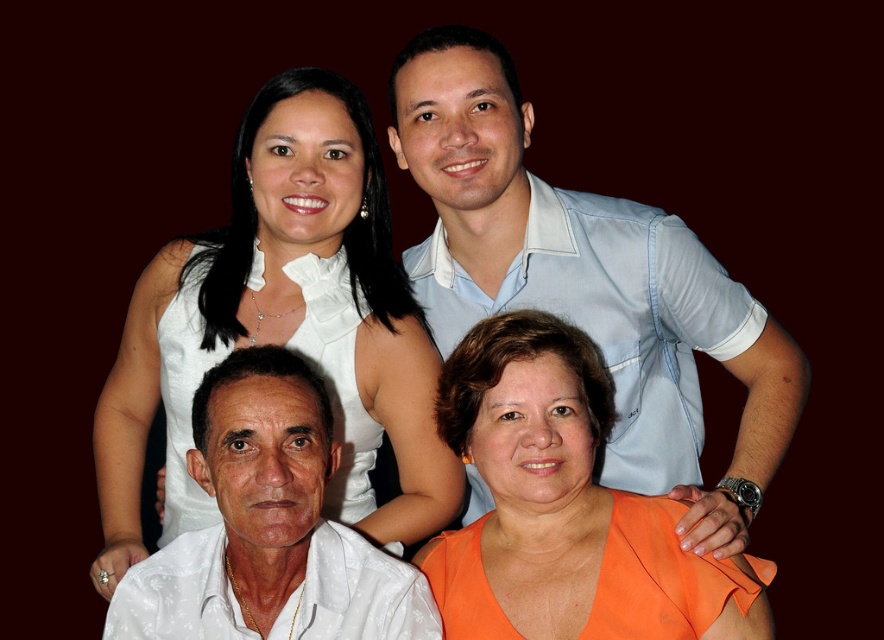
Question: Which of the following is the closest to the observer?

Choices:
 (A) white satin dress at upper center
 (B) orange fabric shirt at lower right
 (C) white satin shirt at lower left

Answer: (C)

Question: Can you confirm if white satin dress at upper center is positioned below orange fabric shirt at lower right?

Choices:
 (A) no
 (B) yes

Answer: (A)

Question: Which point appears closest to the camera in this image?

Choices:
 (A) (456, 608)
 (B) (669, 314)
 (C) (418, 316)

Answer: (A)

Question: Is orange fabric shirt at lower right above white satin shirt at lower left?

Choices:
 (A) yes
 (B) no

Answer: (B)

Question: Which point appears farthest from the camera in this image?

Choices:
 (A) (278, 589)
 (B) (587, 340)

Answer: (B)

Question: From the image, what is the correct spatial relationship of white satin dress at upper center in relation to orange fabric shirt at lower right?

Choices:
 (A) above
 (B) below

Answer: (A)